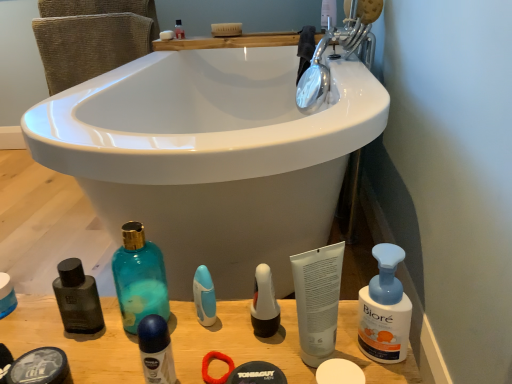
Where is `vacant area that lies in front of teal glass bottle at lower left, positioned as the second cleaning product in right-to-left order`? This screenshot has height=384, width=512. vacant area that lies in front of teal glass bottle at lower left, positioned as the second cleaning product in right-to-left order is located at coordinates (140, 356).